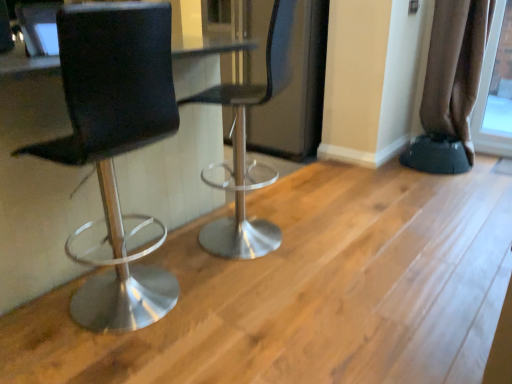
I want to click on matte black stool at left, which ranks as the 1th chair in left-to-right order, so click(116, 142).

The width and height of the screenshot is (512, 384). What do you see at coordinates (245, 149) in the screenshot?
I see `metallic silver stool at center, the 2th chair from the left` at bounding box center [245, 149].

Locate an element on the screen. This screenshot has height=384, width=512. black rubber step stool at lower right is located at coordinates (436, 154).

From a real-world perspective, which is physically above, matte black stool at left, marked as the second chair in a right-to-left arrangement, or metallic silver stool at center, the 2th chair from the left?

From a 3D spatial view, metallic silver stool at center, the 2th chair from the left, is above.

Does matte black stool at left, marked as the second chair in a right-to-left arrangement, lie behind metallic silver stool at center, which is the first chair from right to left?

No, matte black stool at left, marked as the second chair in a right-to-left arrangement, is closer to the camera.

Considering the sizes of matte black stool at left, marked as the second chair in a right-to-left arrangement, and metallic silver stool at center, which is the first chair from right to left, in the image, is matte black stool at left, marked as the second chair in a right-to-left arrangement, taller or shorter than metallic silver stool at center, which is the first chair from right to left,?

matte black stool at left, marked as the second chair in a right-to-left arrangement, is shorter than metallic silver stool at center, which is the first chair from right to left.

Between transparent glass screen door at center and brown fabric curtain at right, which one is positioned behind?

transparent glass screen door at center is more distant.

Considering the sizes of objects transparent glass screen door at center and brown fabric curtain at right in the image provided, who is thinner, transparent glass screen door at center or brown fabric curtain at right?

brown fabric curtain at right.

Which is behind, point (286, 101) or point (442, 76)?

The point (286, 101) is behind.

Does transparent glass screen door at center have a larger size compared to brown fabric curtain at right?

Correct, transparent glass screen door at center is larger in size than brown fabric curtain at right.

How far apart are metallic silver stool at center, which is the first chair from right to left, and brown fabric curtain at right?

metallic silver stool at center, which is the first chair from right to left, is 1.44 meters away from brown fabric curtain at right.

Is metallic silver stool at center, the 2th chair from the left, further to the viewer compared to brown fabric curtain at right?

No, metallic silver stool at center, the 2th chair from the left, is closer to the viewer.

Does metallic silver stool at center, the 2th chair from the left, have a larger size compared to brown fabric curtain at right?

Indeed, metallic silver stool at center, the 2th chair from the left, has a larger size compared to brown fabric curtain at right.

From a real-world perspective, between metallic silver stool at center, the 2th chair from the left, and brown fabric curtain at right, who is vertically higher?

brown fabric curtain at right.

Is matte black stool at left, which ranks as the 1th chair in left-to-right order, looking in the opposite direction of black rubber step stool at lower right?

That's not correct — matte black stool at left, which ranks as the 1th chair in left-to-right order, is not looking away from black rubber step stool at lower right.

Considering the positions of point (113, 229) and point (434, 153), is point (113, 229) closer or farther from the camera than point (434, 153)?

Point (113, 229).

Does matte black stool at left, marked as the second chair in a right-to-left arrangement, lie in front of black rubber step stool at lower right?

Yes, it is in front of black rubber step stool at lower right.

From a real-world perspective, is matte black stool at left, marked as the second chair in a right-to-left arrangement, located beneath black rubber step stool at lower right?

No, from a real-world perspective, matte black stool at left, marked as the second chair in a right-to-left arrangement, is not beneath black rubber step stool at lower right.

From the image's perspective, which is below, transparent glass screen door at center or matte black stool at left, which ranks as the 1th chair in left-to-right order?

matte black stool at left, which ranks as the 1th chair in left-to-right order, is shown below in the image.

You are a GUI agent. You are given a task and a screenshot of the screen. Output one action in this format:
    pyautogui.click(x=<x>, y=<y>)
    Task: Click on the screen door above the matte black stool at left, which ranks as the 1th chair in left-to-right order (from the image's perspective)
    This screenshot has height=384, width=512.
    Given the screenshot: What is the action you would take?
    point(288,78)

Can you tell me how much transparent glass screen door at center and matte black stool at left, marked as the second chair in a right-to-left arrangement, differ in facing direction?

The angular difference between transparent glass screen door at center and matte black stool at left, marked as the second chair in a right-to-left arrangement, is 86.1 degrees.

From a real-world perspective, which is physically above, transparent glass screen door at center or matte black stool at left, marked as the second chair in a right-to-left arrangement?

transparent glass screen door at center is physically above.

From the image's perspective, which one is positioned lower, brown fabric curtain at right or matte black stool at left, which ranks as the 1th chair in left-to-right order?

matte black stool at left, which ranks as the 1th chair in left-to-right order, appears lower in the image.

Is brown fabric curtain at right positioned behind matte black stool at left, marked as the second chair in a right-to-left arrangement?

Yes.

Which object is positioned more to the right, brown fabric curtain at right or matte black stool at left, which ranks as the 1th chair in left-to-right order?

From the viewer's perspective, brown fabric curtain at right appears more on the right side.

Is brown fabric curtain at right positioned with its back to matte black stool at left, marked as the second chair in a right-to-left arrangement?

No.

Does brown fabric curtain at right have a larger size compared to metallic silver stool at center, the 2th chair from the left?

No, brown fabric curtain at right is not bigger than metallic silver stool at center, the 2th chair from the left.

Is brown fabric curtain at right facing away from metallic silver stool at center, which is the first chair from right to left?

No, metallic silver stool at center, which is the first chair from right to left, is not at the back of brown fabric curtain at right.

Between brown fabric curtain at right and metallic silver stool at center, the 2th chair from the left, which one appears on the left side from the viewer's perspective?

From the viewer's perspective, metallic silver stool at center, the 2th chair from the left, appears more on the left side.

From a real-world perspective, between brown fabric curtain at right and metallic silver stool at center, which is the first chair from right to left, who is vertically lower?

metallic silver stool at center, which is the first chair from right to left.

At what (x,y) coordinates should I click in order to perform the action: click on chair lying on the right of matte black stool at left, marked as the second chair in a right-to-left arrangement. Please return your answer as a coordinate pair (x, y). Image resolution: width=512 pixels, height=384 pixels. Looking at the image, I should click on (245, 149).

Identify the location of screen door lying above the brown fabric curtain at right (from the image's perspective). 288,78.

Looking at the image, which one is located further to black rubber step stool at lower right, transparent glass screen door at center or brown fabric curtain at right?

Among the two, transparent glass screen door at center is located further to black rubber step stool at lower right.

Looking at the image, which one is located closer to metallic silver stool at center, which is the first chair from right to left, transparent glass screen door at center or matte black stool at left, which ranks as the 1th chair in left-to-right order?

Based on the image, matte black stool at left, which ranks as the 1th chair in left-to-right order, appears to be nearer to metallic silver stool at center, which is the first chair from right to left.

When comparing their distances from transparent glass screen door at center, does black rubber step stool at lower right or matte black stool at left, which ranks as the 1th chair in left-to-right order, seem further?

A: Based on the image, matte black stool at left, which ranks as the 1th chair in left-to-right order, appears to be further to transparent glass screen door at center.

From the picture: From the image, which object appears to be farther from brown fabric curtain at right, transparent glass screen door at center or matte black stool at left, marked as the second chair in a right-to-left arrangement?

The object further to brown fabric curtain at right is matte black stool at left, marked as the second chair in a right-to-left arrangement.

Which object lies nearer to the anchor point metallic silver stool at center, the 2th chair from the left, brown fabric curtain at right or transparent glass screen door at center?

Among the two, transparent glass screen door at center is located nearer to metallic silver stool at center, the 2th chair from the left.

Which object lies further to the anchor point transparent glass screen door at center, black rubber step stool at lower right or metallic silver stool at center, which is the first chair from right to left?

black rubber step stool at lower right is further to transparent glass screen door at center.

From the picture: Based on their spatial positions, is brown fabric curtain at right or metallic silver stool at center, the 2th chair from the left, further from transparent glass screen door at center?

brown fabric curtain at right is positioned further to the anchor transparent glass screen door at center.

Based on the photo, estimate the real-world distances between objects in this image. Which object is closer to transparent glass screen door at center, black rubber step stool at lower right or brown fabric curtain at right?

The object closer to transparent glass screen door at center is black rubber step stool at lower right.

You are a GUI agent. You are given a task and a screenshot of the screen. Output one action in this format:
    pyautogui.click(x=<x>, y=<y>)
    Task: Click on the step stool between metallic silver stool at center, the 2th chair from the left, and brown fabric curtain at right from left to right
    The image size is (512, 384).
    Given the screenshot: What is the action you would take?
    pyautogui.click(x=436, y=154)

You are a GUI agent. You are given a task and a screenshot of the screen. Output one action in this format:
    pyautogui.click(x=<x>, y=<y>)
    Task: Click on the chair between matte black stool at left, marked as the second chair in a right-to-left arrangement, and black rubber step stool at lower right, in the horizontal direction
    Image resolution: width=512 pixels, height=384 pixels.
    Given the screenshot: What is the action you would take?
    pyautogui.click(x=245, y=149)

This screenshot has width=512, height=384. Find the location of `screen door between matte black stool at left, marked as the second chair in a right-to-left arrangement, and black rubber step stool at lower right from front to back`. screen door between matte black stool at left, marked as the second chair in a right-to-left arrangement, and black rubber step stool at lower right from front to back is located at coordinates [x=288, y=78].

Where is `chair between matte black stool at left, which ranks as the 1th chair in left-to-right order, and brown fabric curtain at right from left to right`? chair between matte black stool at left, which ranks as the 1th chair in left-to-right order, and brown fabric curtain at right from left to right is located at coordinates (245, 149).